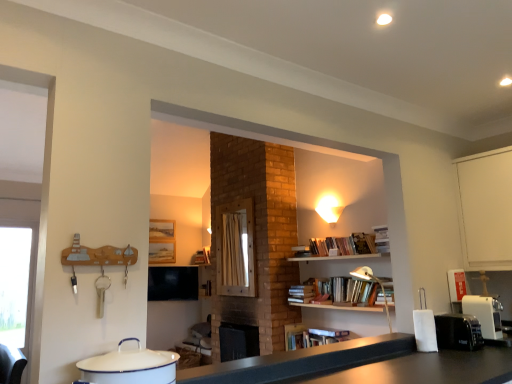
This screenshot has height=384, width=512. I want to click on vacant point above black matte counter top at center (from a real-world perspective), so click(x=308, y=357).